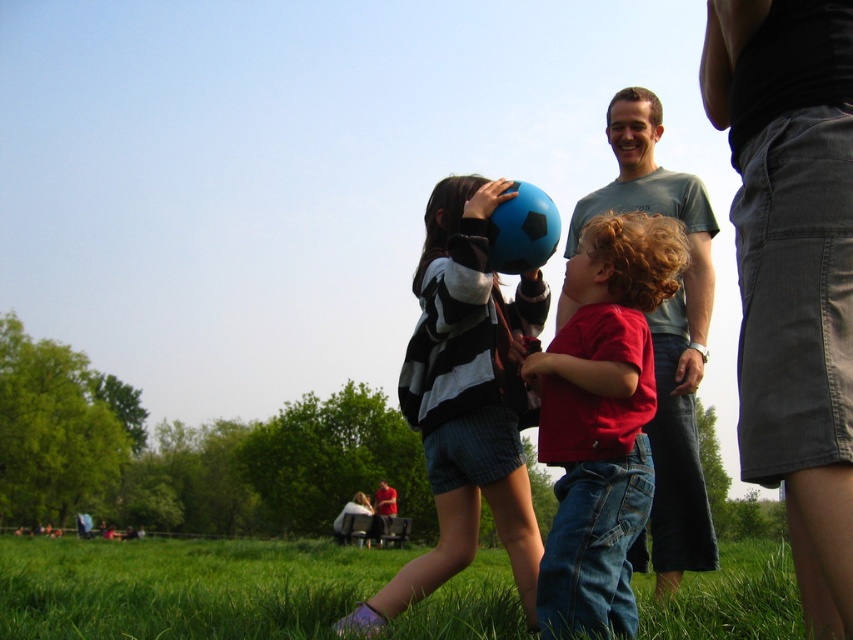
Question: Does matte blue ball at center appear on the left side of blue rubber ball at center?

Choices:
 (A) no
 (B) yes

Answer: (B)

Question: Which point appears farthest from the camera in this image?

Choices:
 (A) (656, 99)
 (B) (457, 444)
 (C) (834, 188)

Answer: (A)

Question: Based on their relative distances, which object is nearer to the black cotton skirt at upper right?

Choices:
 (A) green grass at lower center
 (B) matte blue ball at center
 (C) matte red shirt at center

Answer: (C)

Question: Which of the following is the closest to the observer?

Choices:
 (A) (830, 541)
 (B) (659, 340)

Answer: (A)

Question: Is matte gray t-shirt at upper right wider than blue rubber ball at center?

Choices:
 (A) no
 (B) yes

Answer: (A)

Question: Can you confirm if black cotton skirt at upper right is bigger than blue rubber ball at center?

Choices:
 (A) yes
 (B) no

Answer: (B)